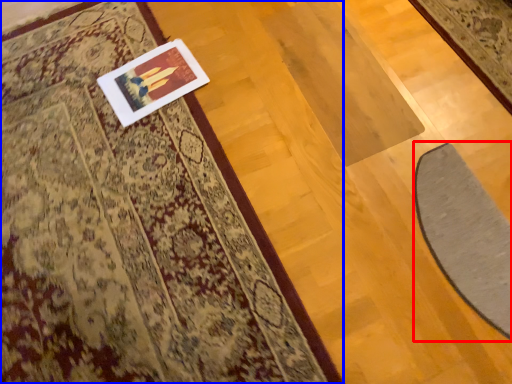
Question: Among these objects, which one is farthest to the camera, doormat (highlighted by a red box) or mat (highlighted by a blue box)?

Choices:
 (A) doormat
 (B) mat

Answer: (A)